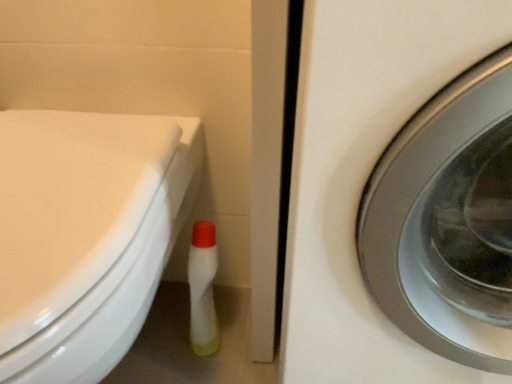
Find the location of a particular element. The image size is (512, 384). free space above white glossy bidet at lower left (from a real-world perspective) is located at coordinates (59, 176).